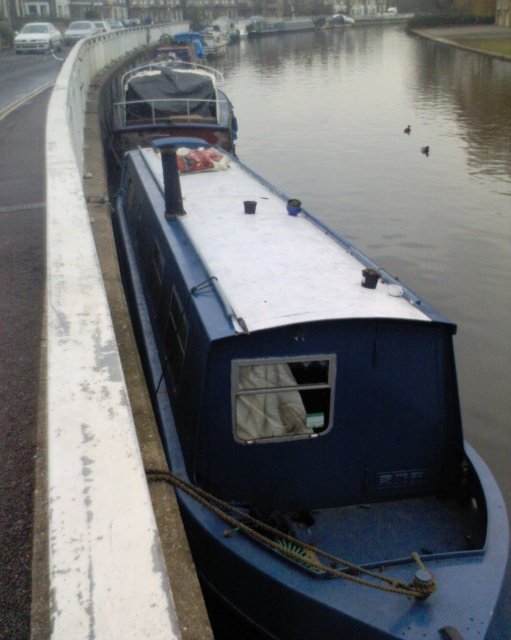
Can you confirm if blue matte barge at center is smaller than blue matte boat at center?

Correct, blue matte barge at center occupies less space than blue matte boat at center.

Can you confirm if blue matte barge at center is taller than blue matte boat at center?

Incorrect, blue matte barge at center's height is not larger of blue matte boat at center's.

Where is `blue matte barge at center`? The image size is (511, 640). blue matte barge at center is located at coordinates (303, 410).